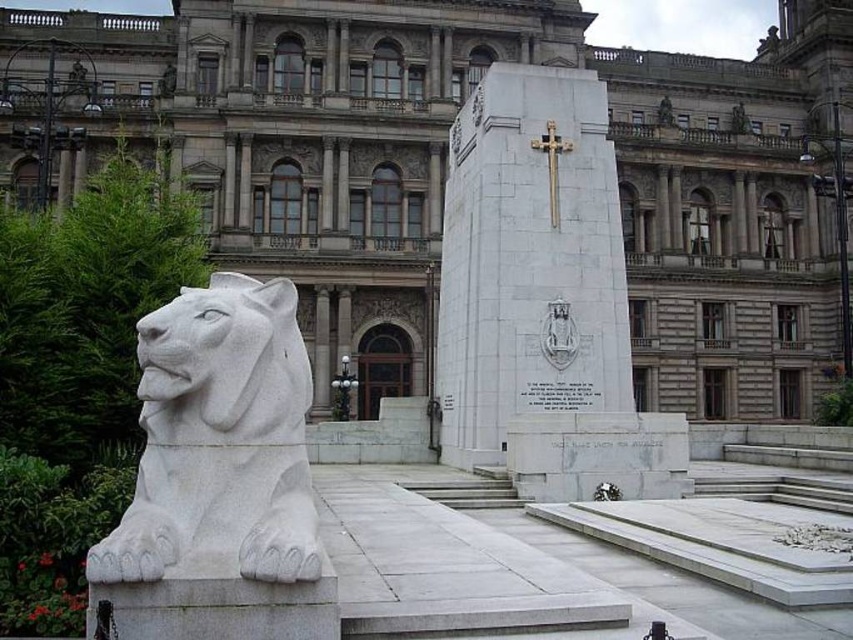
You are an architect planning to place a new statue between the white marble monument at center and the white stone lion at left. Given their widths, which object should the statue be closer to to ensure it fits proportionally?

The white marble monument at center is wider than the white stone lion at left. To ensure the statue fits proportionally, it should be placed closer to the white stone lion at left since it has a narrower width.

You are an architect visiting this site and need to place a new statue exactly halfway between the white marble monument at center and the white stone lion at left. Given the monument is larger, will the statue be closer to the monument or the lion?

The statue will be closer to the white stone lion at left because the white marble monument at center is larger and thus occupies more space, requiring the halfway point to be nearer to the smaller lion to balance the distance.

You are standing at the entrance of the grand architectural setting. You want to find the white marble monument at center. Based on the coordinates provided, which object is located at point (x=543, y=298)?

The point (x=543, y=298) corresponds to the white marble monument at center.